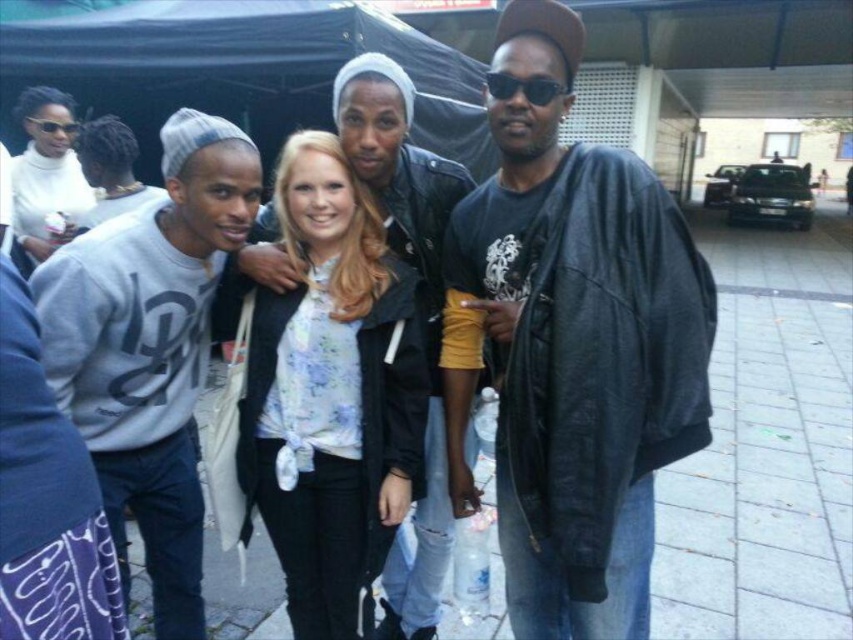
Question: Which point is farther to the camera?

Choices:
 (A) (521, 64)
 (B) (345, 170)
 (C) (123, 586)
 (D) (25, 131)

Answer: (D)

Question: Which object appears farthest from the camera in this image?

Choices:
 (A) floral print blouse at center
 (B) white matte sweater at upper left
 (C) gray cotton sweatshirt at left

Answer: (B)

Question: Can you confirm if dark gray leather jacket at center is smaller than white matte sweater at upper left?

Choices:
 (A) no
 (B) yes

Answer: (A)

Question: Is dark gray leather jacket at center to the left of white matte sweater at upper left from the viewer's perspective?

Choices:
 (A) no
 (B) yes

Answer: (A)

Question: Is dark gray leather jacket at center to the left of floral print blouse at center from the viewer's perspective?

Choices:
 (A) yes
 (B) no

Answer: (B)

Question: Which of the following is the closest to the observer?

Choices:
 (A) floral print blouse at center
 (B) white matte sweater at upper left
 (C) gray cotton sweatshirt at left
 (D) dark gray leather jacket at center

Answer: (D)